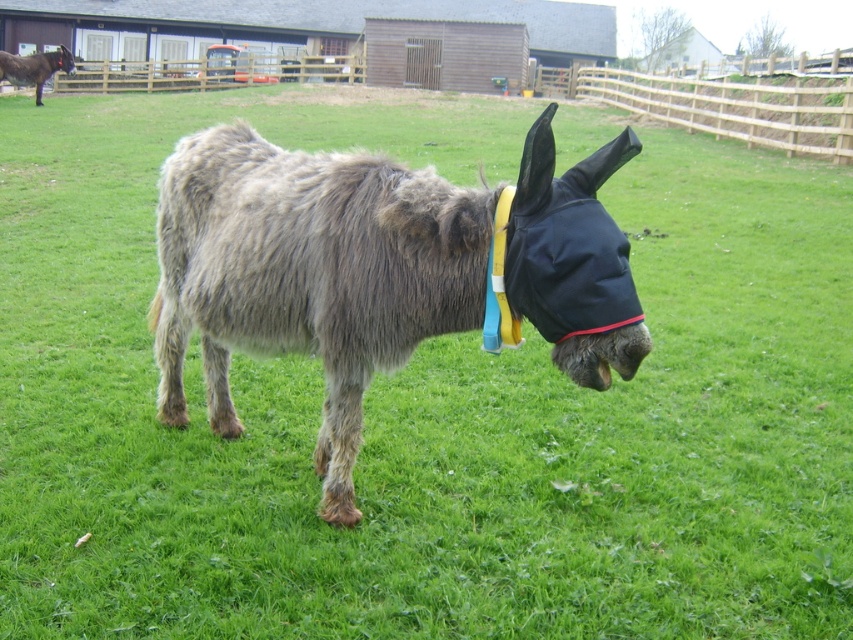
Question: Is fuzzy gray donkey at center to the right of brown fuzzy mule at upper left from the viewer's perspective?

Choices:
 (A) yes
 (B) no

Answer: (A)

Question: Can you confirm if fuzzy gray donkey at center is bigger than brown fuzzy mule at upper left?

Choices:
 (A) no
 (B) yes

Answer: (A)

Question: Is fuzzy gray donkey at center below brown fuzzy mule at upper left?

Choices:
 (A) no
 (B) yes

Answer: (B)

Question: Which object is closer to the camera taking this photo?

Choices:
 (A) brown fuzzy mule at upper left
 (B) fuzzy gray donkey at center

Answer: (B)

Question: Which point appears closest to the camera in this image?

Choices:
 (A) (607, 355)
 (B) (64, 60)

Answer: (A)